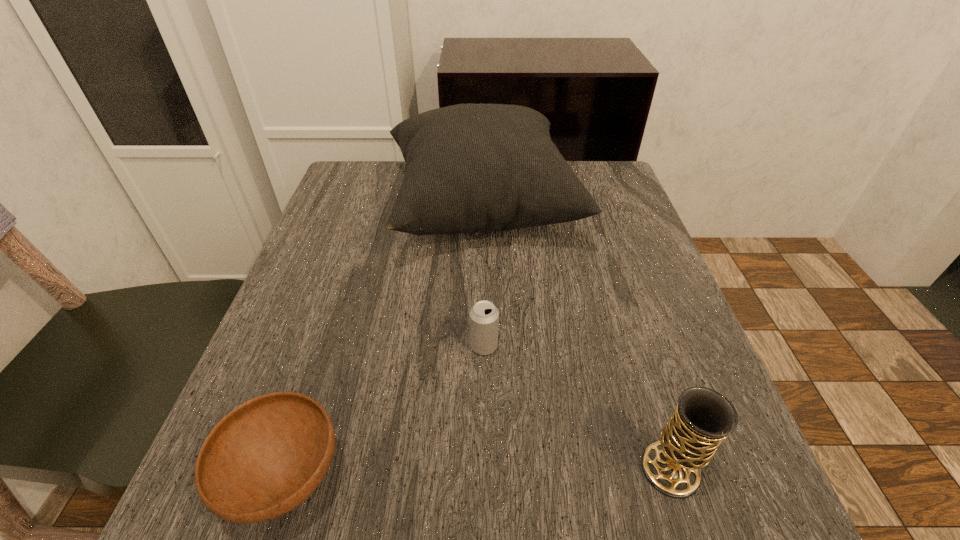
The height and width of the screenshot is (540, 960). I want to click on vacant space that satisfies the following two spatial constraints: 1. on the front side of the cushion; 2. on the right side of the chalice, so (483, 470).